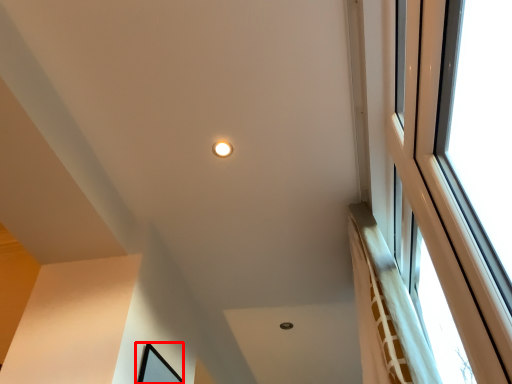
Question: In this image, where is picture frame (annotated by the red box) located relative to lighting?

Choices:
 (A) left
 (B) right

Answer: (A)